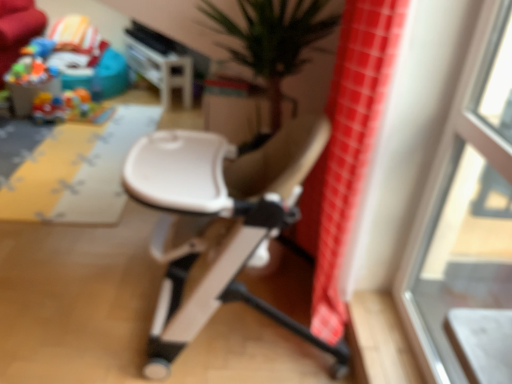
Question: Does plastic colorful toys at upper left have a smaller size compared to white plastic chair at center?

Choices:
 (A) yes
 (B) no

Answer: (A)

Question: Does plastic colorful toys at upper left appear on the right side of white plastic chair at center?

Choices:
 (A) no
 (B) yes

Answer: (A)

Question: Can white plastic chair at center be found inside plastic colorful toys at upper left?

Choices:
 (A) no
 (B) yes

Answer: (A)

Question: Is plastic colorful toys at upper left far away from white plastic chair at center?

Choices:
 (A) no
 (B) yes

Answer: (B)

Question: Is plastic colorful toys at upper left not inside white plastic chair at center?

Choices:
 (A) yes
 (B) no

Answer: (A)

Question: Is transparent glass window at upper right in front of or behind plastic colorful toys at upper left in the image?

Choices:
 (A) front
 (B) behind

Answer: (A)

Question: Considering the positions of transparent glass window at upper right and plastic colorful toys at upper left in the image, is transparent glass window at upper right wider or thinner than plastic colorful toys at upper left?

Choices:
 (A) wide
 (B) thin

Answer: (B)

Question: Is transparent glass window at upper right to the left or to the right of plastic colorful toys at upper left in the image?

Choices:
 (A) left
 (B) right

Answer: (B)

Question: Is transparent glass window at upper right spatially inside plastic colorful toys at upper left, or outside of it?

Choices:
 (A) inside
 (B) outside

Answer: (B)

Question: Would you say yellow fabric play mat at left is to the left or to the right of white plastic chair at center in the picture?

Choices:
 (A) right
 (B) left

Answer: (B)

Question: Considering the positions of yellow fabric play mat at left and white plastic chair at center in the image, is yellow fabric play mat at left bigger or smaller than white plastic chair at center?

Choices:
 (A) small
 (B) big

Answer: (A)

Question: From the image's perspective, is yellow fabric play mat at left located above or below white plastic chair at center?

Choices:
 (A) below
 (B) above

Answer: (B)

Question: Is yellow fabric play mat at left in front of or behind white plastic chair at center in the image?

Choices:
 (A) front
 (B) behind

Answer: (B)

Question: From a real-world perspective, is red checkered fabric at right physically located above or below transparent glass window at upper right?

Choices:
 (A) below
 (B) above

Answer: (A)

Question: From their relative heights in the image, would you say red checkered fabric at right is taller or shorter than transparent glass window at upper right?

Choices:
 (A) short
 (B) tall

Answer: (B)